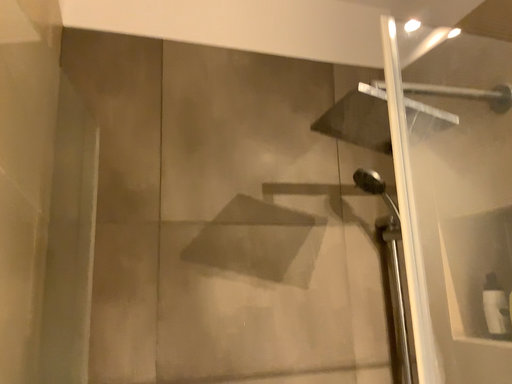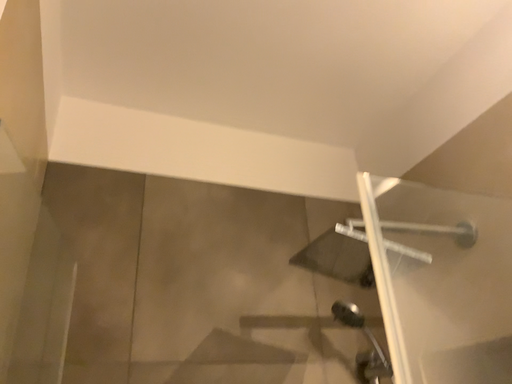
Question: How did the camera likely rotate when shooting the video?

Choices:
 (A) rotated downward
 (B) rotated upward

Answer: (B)